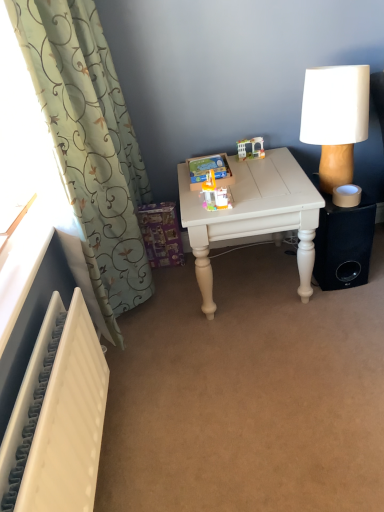
Identify the location of vacant region under white painted wood table at center (from a real-world perspective). (252, 278).